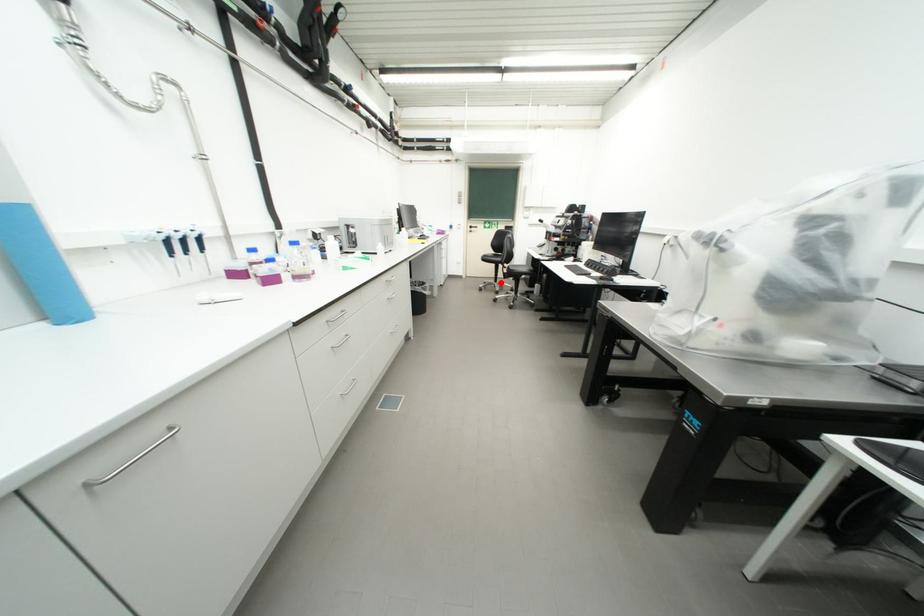
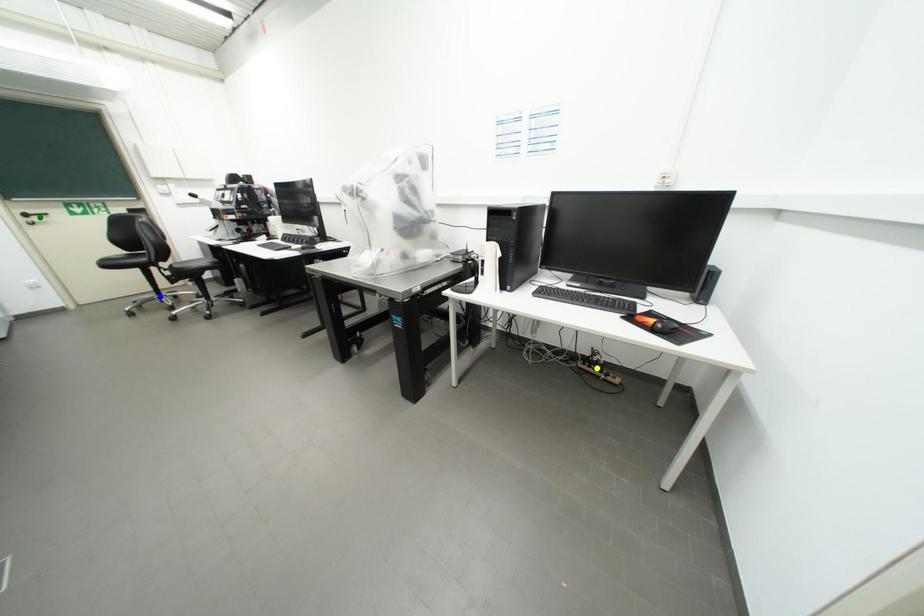
Question: I am providing you with two images of the same scene from different viewpoints. A red point is marked on the first image. You are given multiple points on the second image. Which point in image 2 represents the same 3d spot as the red point in image 1?

Choices:
 (A) green point
 (B) yellow point
 (C) blue point

Answer: (C)